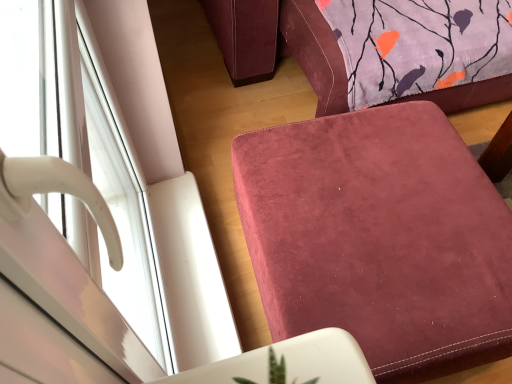
Question: Is point (59, 109) closer or farther from the camera than point (329, 190)?

Choices:
 (A) closer
 (B) farther

Answer: (A)

Question: Looking at the image, does white glossy window handle at left seem bigger or smaller compared to suede-like burgundy ottoman at lower right?

Choices:
 (A) big
 (B) small

Answer: (B)

Question: From the image's perspective, is white glossy window handle at left located above or below suede-like burgundy ottoman at lower right?

Choices:
 (A) above
 (B) below

Answer: (A)

Question: Looking at their shapes, would you say suede-like burgundy ottoman at lower right is wider or thinner than white glossy window handle at left?

Choices:
 (A) wide
 (B) thin

Answer: (A)

Question: Is suede-like burgundy ottoman at lower right inside the boundaries of white glossy window handle at left, or outside?

Choices:
 (A) outside
 (B) inside

Answer: (A)

Question: In terms of height, does suede-like burgundy ottoman at lower right look taller or shorter compared to white glossy window handle at left?

Choices:
 (A) tall
 (B) short

Answer: (B)

Question: Based on their sizes in the image, would you say suede-like burgundy ottoman at lower right is bigger or smaller than white glossy window handle at left?

Choices:
 (A) big
 (B) small

Answer: (A)